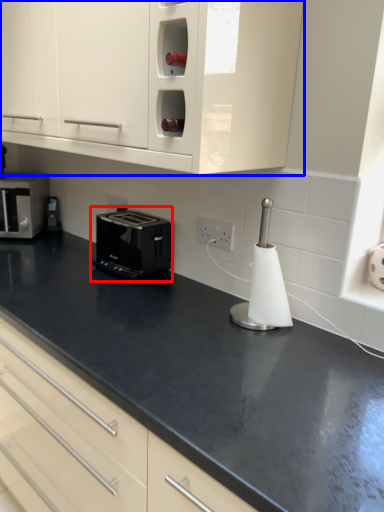
Question: Which object appears closest to the camera in this image, toaster (highlighted by a red box) or cabinetry (highlighted by a blue box)?

Choices:
 (A) toaster
 (B) cabinetry

Answer: (B)